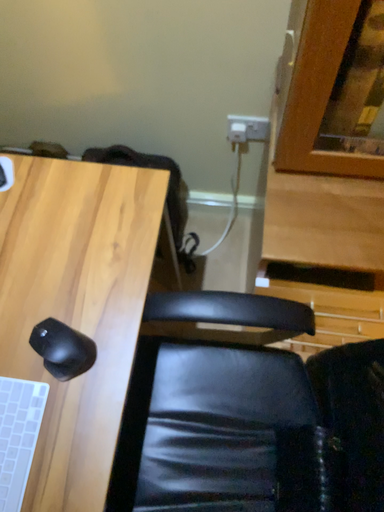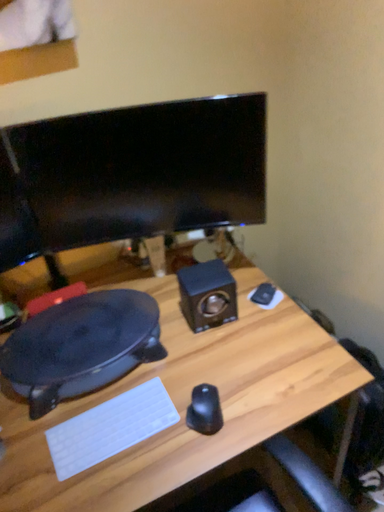
Question: Which way did the camera rotate in the video?

Choices:
 (A) rotated upward
 (B) rotated downward

Answer: (A)